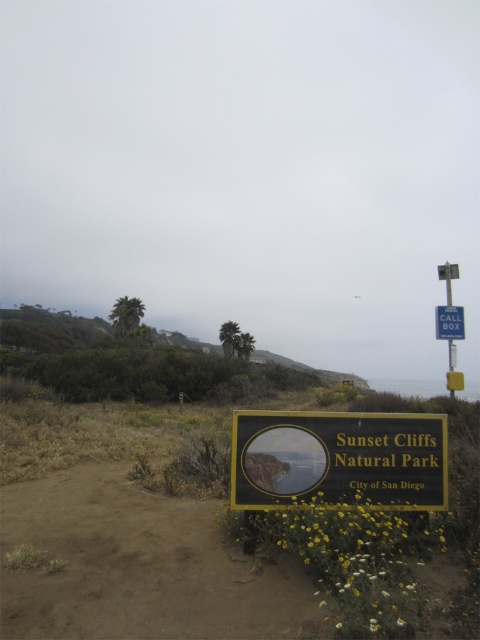
Question: Among these objects, which one is farthest from the camera?

Choices:
 (A) blue metallic call box at upper right
 (B) blue plastic call box at upper right
 (C) green leafy vegetation at left
 (D) brown sandy soil at lower center

Answer: (C)

Question: In this image, where is brown sandy soil at lower center located relative to gold metallic sign at center?

Choices:
 (A) below
 (B) above

Answer: (A)

Question: Does gold metallic sign at center appear over green leafy vegetation at left?

Choices:
 (A) no
 (B) yes

Answer: (B)

Question: Which point appears closest to the camera in this image?

Choices:
 (A) (444, 320)
 (B) (236, 577)
 (C) (358, 488)

Answer: (B)

Question: Which of the following is the farthest from the observer?

Choices:
 (A) blue plastic call box at upper right
 (B) green leafy vegetation at left
 (C) brown sandy soil at lower center

Answer: (B)

Question: Does gold metallic sign at center appear on the right side of green leafy vegetation at left?

Choices:
 (A) no
 (B) yes

Answer: (B)